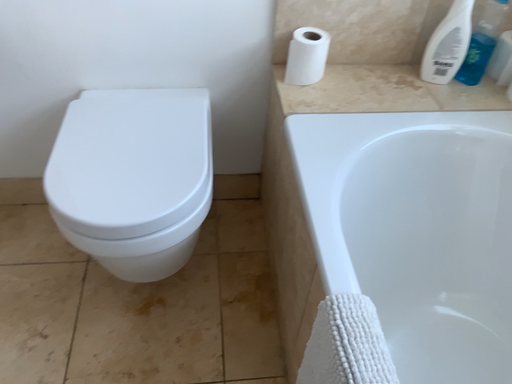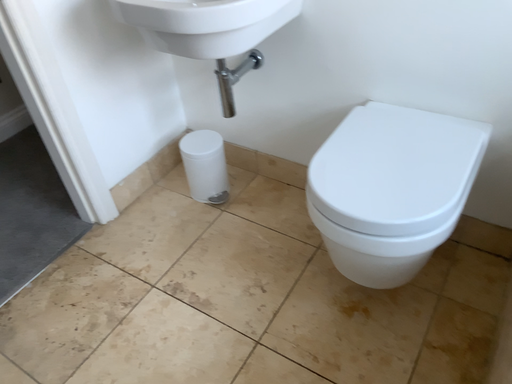
Question: How did the camera likely rotate when shooting the video?

Choices:
 (A) rotated right
 (B) rotated left

Answer: (B)